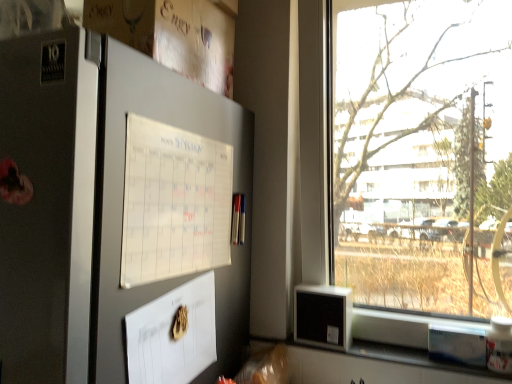
Question: Looking at their shapes, would you say white paper calendar at upper left is wider or thinner than satin silver fridge at left?

Choices:
 (A) wide
 (B) thin

Answer: (B)

Question: Based on their sizes in the image, would you say white paper calendar at upper left is bigger or smaller than satin silver fridge at left?

Choices:
 (A) big
 (B) small

Answer: (B)

Question: Estimate the real-world distances between objects in this image. Which object is farther from the satin silver fridge at left?

Choices:
 (A) transparent glass window at right
 (B) white paper calendar at upper left

Answer: (A)

Question: Which object is the farthest from the white paper calendar at upper left?

Choices:
 (A) satin silver fridge at left
 (B) transparent glass window at right

Answer: (B)